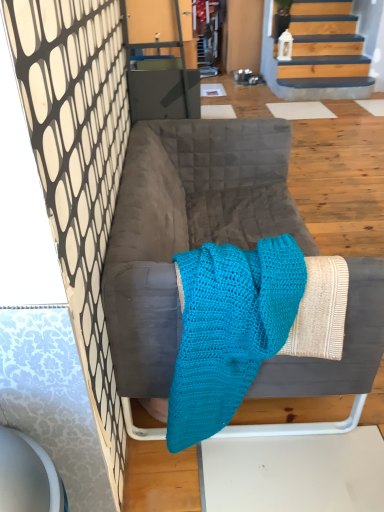
Question: From the image's perspective, is turquoise knitted blanket at center positioned above or below velvet gray sofa at center?

Choices:
 (A) above
 (B) below

Answer: (B)

Question: Based on their positions, is turquoise knitted blanket at center located to the left or right of velvet gray sofa at center?

Choices:
 (A) left
 (B) right

Answer: (A)

Question: Relative to velvet gray sofa at center, is turquoise knitted blanket at center in front or behind?

Choices:
 (A) behind
 (B) front

Answer: (B)

Question: From the image's perspective, is velvet gray sofa at center located above or below turquoise knitted blanket at center?

Choices:
 (A) below
 (B) above

Answer: (B)

Question: Considering the positions of point (165, 176) and point (268, 243), is point (165, 176) closer or farther from the camera than point (268, 243)?

Choices:
 (A) farther
 (B) closer

Answer: (A)

Question: In the image, is velvet gray sofa at center positioned in front of or behind turquoise knitted blanket at center?

Choices:
 (A) behind
 (B) front

Answer: (A)

Question: Is velvet gray sofa at center bigger or smaller than turquoise knitted blanket at center?

Choices:
 (A) small
 (B) big

Answer: (B)